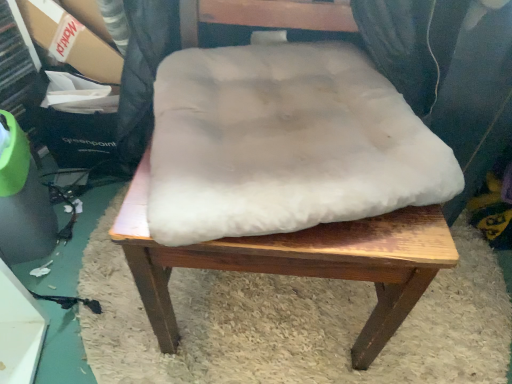
Question: In terms of height, does white fluffy cushion at center look taller or shorter compared to white fluffy cushion at center?

Choices:
 (A) short
 (B) tall

Answer: (A)

Question: Considering the relative positions of white fluffy cushion at center and white fluffy cushion at center in the image provided, is white fluffy cushion at center to the left or to the right of white fluffy cushion at center?

Choices:
 (A) left
 (B) right

Answer: (A)

Question: Based on their relative distances, which object is farther from the white fluffy cushion at center?

Choices:
 (A) white fluffy cushion at center
 (B) cardboard at upper left
 (C) white fluffy cushion at center

Answer: (B)

Question: Based on their relative distances, which object is nearer to the white fluffy cushion at center?

Choices:
 (A) cardboard at upper left
 (B) white fluffy cushion at center
 (C) white fluffy cushion at center

Answer: (B)